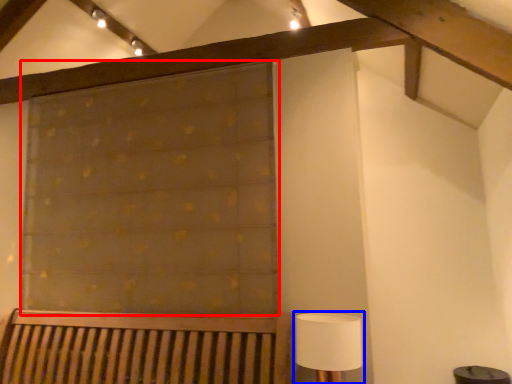
Question: Which object is closer to the camera taking this photo, curtain (highlighted by a red box) or table lamp (highlighted by a blue box)?

Choices:
 (A) curtain
 (B) table lamp

Answer: (B)